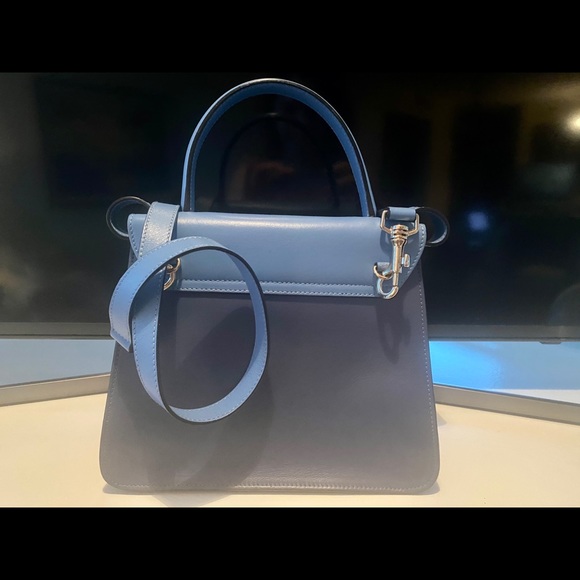
Locate an element on the screen. edge of table is located at coordinates (492, 404).